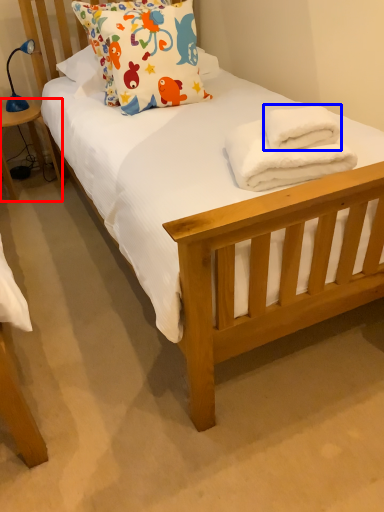
Question: Which of the following is the closest to the observer, table (highlighted by a red box) or bath towel (highlighted by a blue box)?

Choices:
 (A) table
 (B) bath towel

Answer: (B)